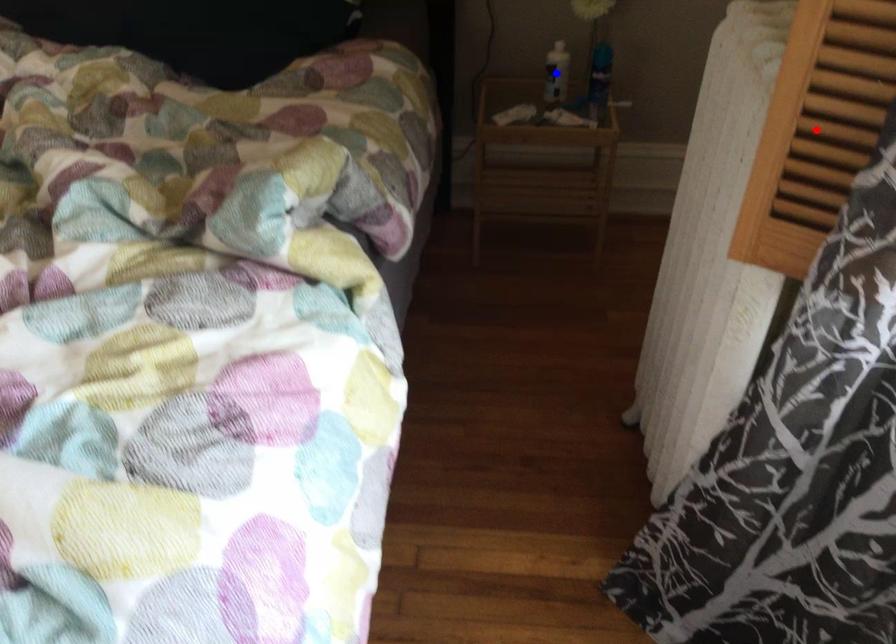
Question: Which of the two points in the image is closer to the camera?

Choices:
 (A) Blue point is closer.
 (B) Red point is closer.

Answer: (B)